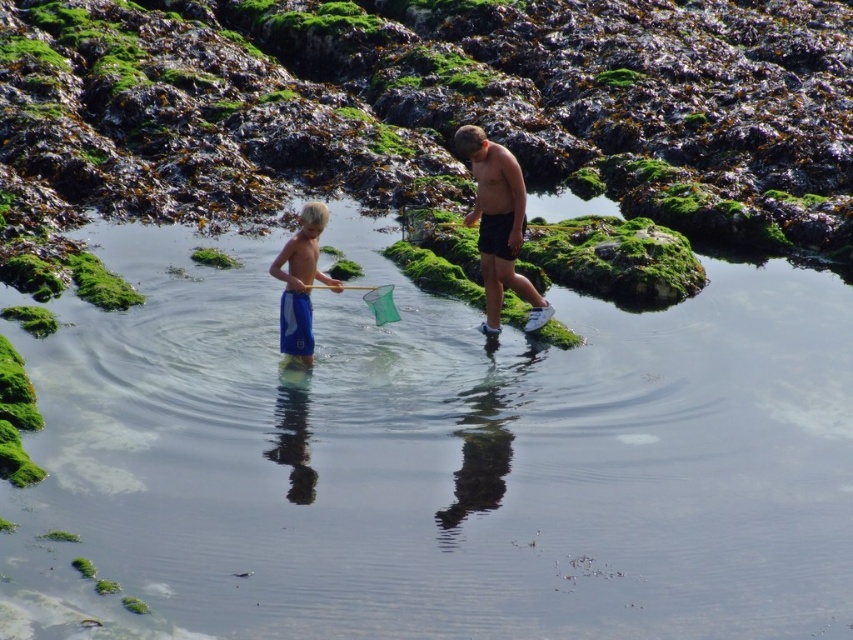
From the picture: You are a photographer planning to capture a wide shot of the two people and the rocky shoreline. Given the distance between the green mossy algae at center and the green mossy algae at upper center, how far apart are these two algae patches in meters?

The distance between the green mossy algae at center and the green mossy algae at upper center is 10.87 meters.

You are a drone operator trying to capture a photo of the green mossy algae at center. The drone is currently at point 0.5, 0.3. What direction should you move the drone to get closer to the algae?

The green mossy algae at center is located at point (213,257). Since the drone is at (254,320), it should move southwest to get closer to the algae.

You are a photographer planning to capture the reflection of the clear water at center and the green mossy algae at upper center. Which area would you focus on to ensure the reflection is more prominent in the photo?

The clear water at center is bigger than the green mossy algae at upper center, so focusing on the clear water at center would result in a more prominent reflection in the photo.